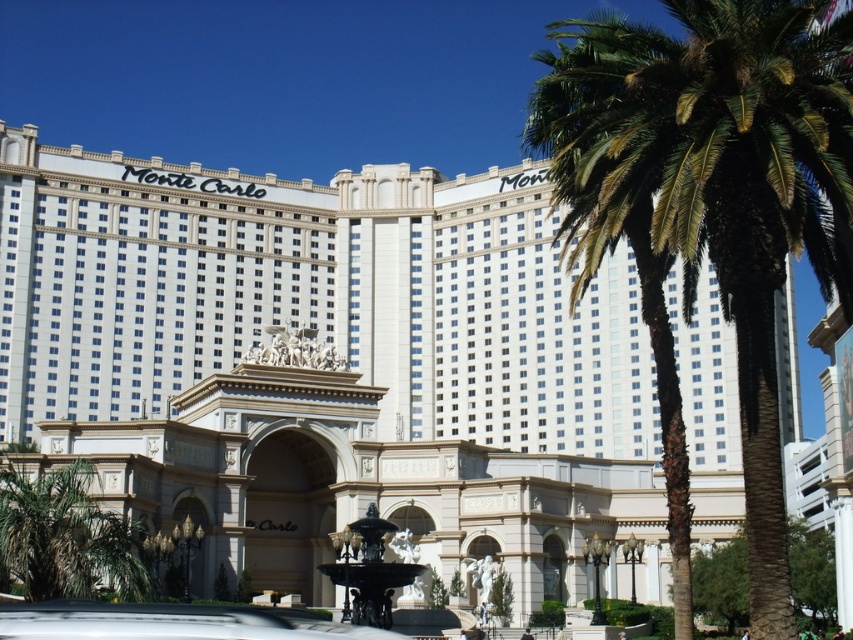
You are standing in front of the Monte Carlo Hotel and Casino. You want to take a photo of the entrance with the green leafy palm at right in the background. Is the palm visible in the photo?

The green leafy palm at right is located at point (712, 188), which is within the frame of the photo taken from the entrance, so it should be visible in the background.

You are standing at the entrance of the Monte Carlo Hotel and Casino, where you see the green leafy palm at right. If you need to reach the palm tree within 10 seconds, what is the minimum speed you must maintain?

The green leafy palm at right is 39.89 meters away. To cover 39.89 meters in 10 seconds, you must maintain a minimum speed of approximately 3.99 meters per second.

Consider the image. You are a photographer planning to capture a wide shot of the Monte Carlo Hotel and Casino. You have a metallic silver car at center and a black polished stone fountain at center in your frame. Considering their sizes, which object should you focus on to ensure both are clearly visible in the photo?

The metallic silver car at center has a smaller size compared to the black polished stone fountain at center. To ensure both are clearly visible, focus on the black polished stone fountain at center since it is larger and will remain in focus while the smaller car can be positioned within the same frame without overfilling the space.